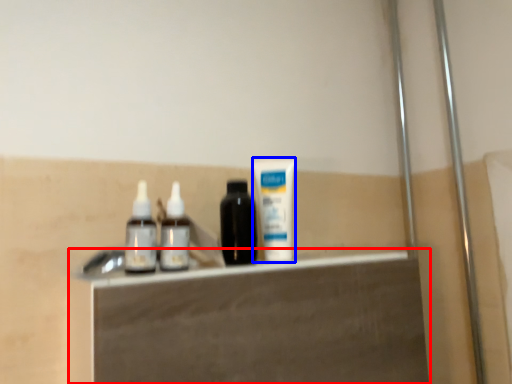
Question: Which point is further to the camera, vanity (highlighted by a red box) or toothpaste (highlighted by a blue box)?

Choices:
 (A) vanity
 (B) toothpaste

Answer: (B)